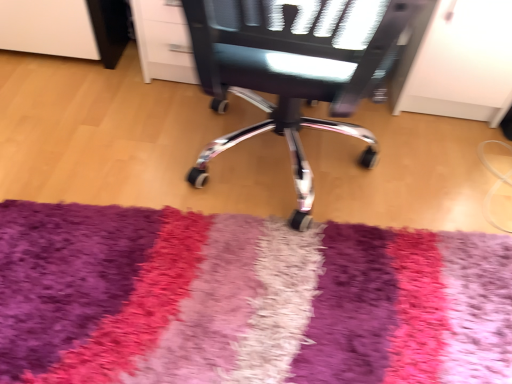
Question: Is there a large distance between metallic mesh chair at center and shaggy multicolor rug at center?

Choices:
 (A) no
 (B) yes

Answer: (A)

Question: From the image's perspective, does metallic mesh chair at center appear higher than shaggy multicolor rug at center?

Choices:
 (A) no
 (B) yes

Answer: (B)

Question: From a real-world perspective, is metallic mesh chair at center below shaggy multicolor rug at center?

Choices:
 (A) no
 (B) yes

Answer: (A)

Question: Can you confirm if metallic mesh chair at center is taller than shaggy multicolor rug at center?

Choices:
 (A) yes
 (B) no

Answer: (A)

Question: From a real-world perspective, is metallic mesh chair at center physically above shaggy multicolor rug at center?

Choices:
 (A) yes
 (B) no

Answer: (A)

Question: Is metallic mesh chair at center located outside shaggy multicolor rug at center?

Choices:
 (A) yes
 (B) no

Answer: (A)

Question: Is shaggy multicolor rug at center far away from metallic mesh chair at center?

Choices:
 (A) no
 (B) yes

Answer: (A)

Question: Would you say metallic mesh chair at center is part of shaggy multicolor rug at center's contents?

Choices:
 (A) no
 (B) yes

Answer: (A)

Question: Is shaggy multicolor rug at center smaller than metallic mesh chair at center?

Choices:
 (A) yes
 (B) no

Answer: (A)

Question: Can you confirm if shaggy multicolor rug at center is wider than metallic mesh chair at center?

Choices:
 (A) no
 (B) yes

Answer: (A)

Question: From a real-world perspective, is shaggy multicolor rug at center beneath metallic mesh chair at center?

Choices:
 (A) yes
 (B) no

Answer: (A)

Question: From a real-world perspective, is shaggy multicolor rug at center physically above metallic mesh chair at center?

Choices:
 (A) yes
 (B) no

Answer: (B)

Question: Is shaggy multicolor rug at center in front of or behind metallic mesh chair at center in the image?

Choices:
 (A) behind
 (B) front

Answer: (A)